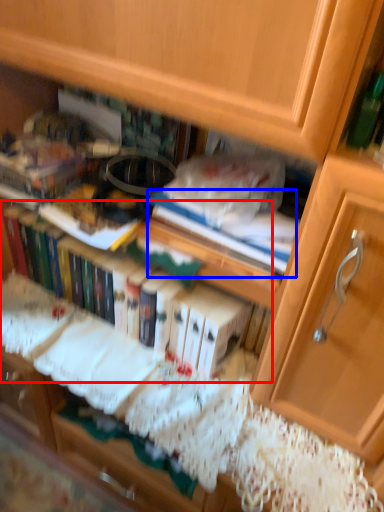
Question: Among these objects, which one is nearest to the camera, book (highlighted by a red box) or paperback book (highlighted by a blue box)?

Choices:
 (A) book
 (B) paperback book

Answer: (B)